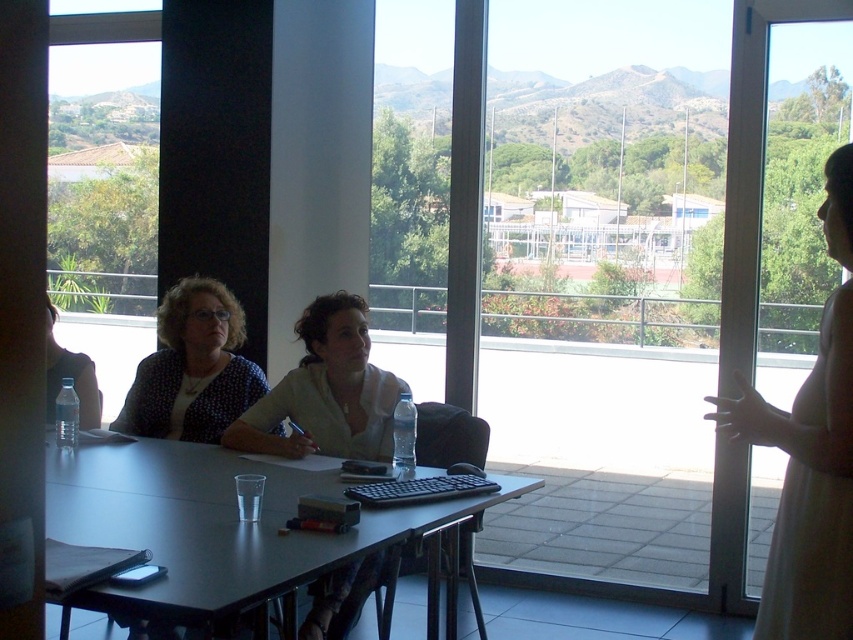
Question: Can you confirm if matte black blouse at left is positioned to the left of matte black shirt at left?

Choices:
 (A) yes
 (B) no

Answer: (B)

Question: Is matte plastic table at center bigger than white matte shirt at center?

Choices:
 (A) no
 (B) yes

Answer: (B)

Question: Which point appears closest to the camera in this image?

Choices:
 (A) (84, 371)
 (B) (67, 532)
 (C) (100, 28)
 (D) (718, 422)

Answer: (D)

Question: Which object is the farthest from the matte black blouse at left?

Choices:
 (A) white matte shirt at center
 (B) transparent glass window at upper left

Answer: (B)

Question: Based on their relative distances, which object is nearer to the matte black shirt at left?

Choices:
 (A) transparent glass window at upper left
 (B) white fabric dress at right

Answer: (A)

Question: Does transparent glass window at upper left appear over matte black shirt at left?

Choices:
 (A) no
 (B) yes

Answer: (B)